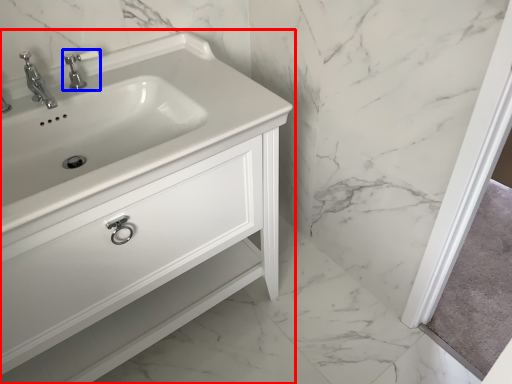
Question: Which point is further to the camera, bathroom cabinet (highlighted by a red box) or tap (highlighted by a blue box)?

Choices:
 (A) bathroom cabinet
 (B) tap

Answer: (B)